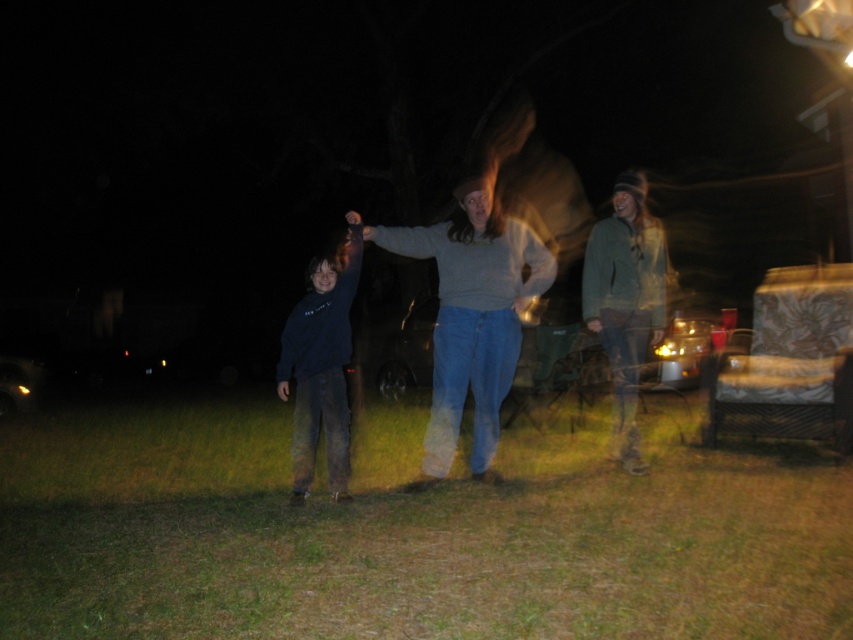
You are standing on the green grass at lower center and want to reach the green textured jacket at center. Given that your arm length is 0.7 meters, can you grab the jacket without moving your feet?

The distance between the green grass at lower center and the green textured jacket at center is 2.34 meters. Since your arm length is only 0.7 meters, you cannot reach the jacket without moving your feet.